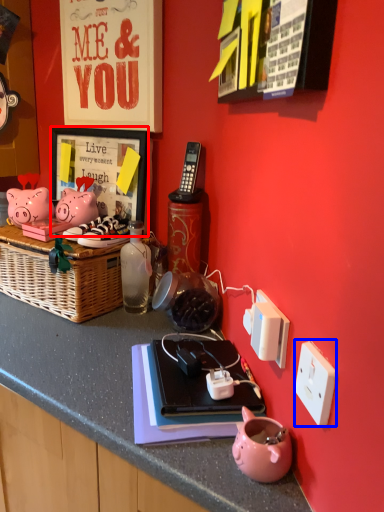
Question: Which of the following is the farthest to the observer, picture frame (highlighted by a red box) or power outlet (highlighted by a blue box)?

Choices:
 (A) picture frame
 (B) power outlet

Answer: (A)